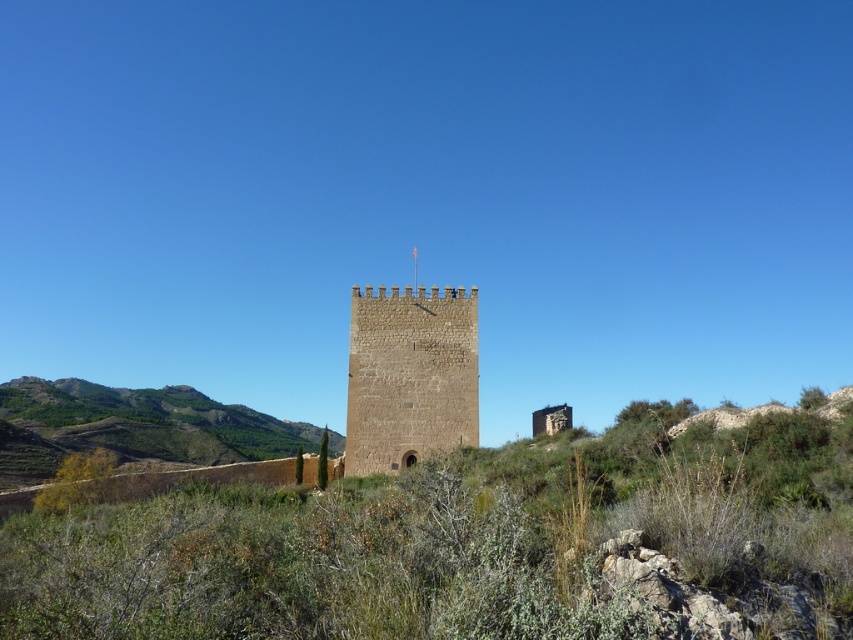
You are standing at the point marked by coordinates point [409,376]. What is the object you are standing on?

The point [409,376] indicates the brown stone tower at center, so you are standing on the brown stone tower at center.

You are standing at the base of the medieval tower and notice a point in the image. Based on the scene description, what can you observe at point (471, 545)?

At point (471, 545), there are green shrubs at center.